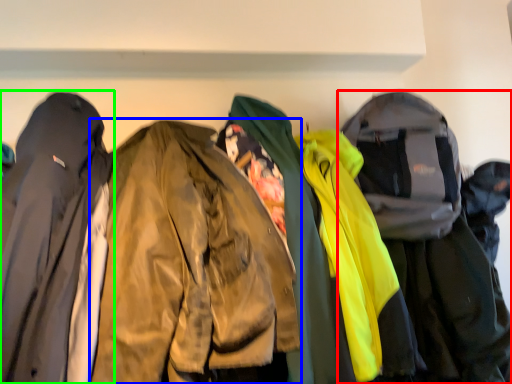
Question: Estimate the real-world distances between objects in this image. Which object is closer to jacket (highlighted by a red box), jacket (highlighted by a blue box) or jacket (highlighted by a green box)?

Choices:
 (A) jacket
 (B) jacket

Answer: (A)